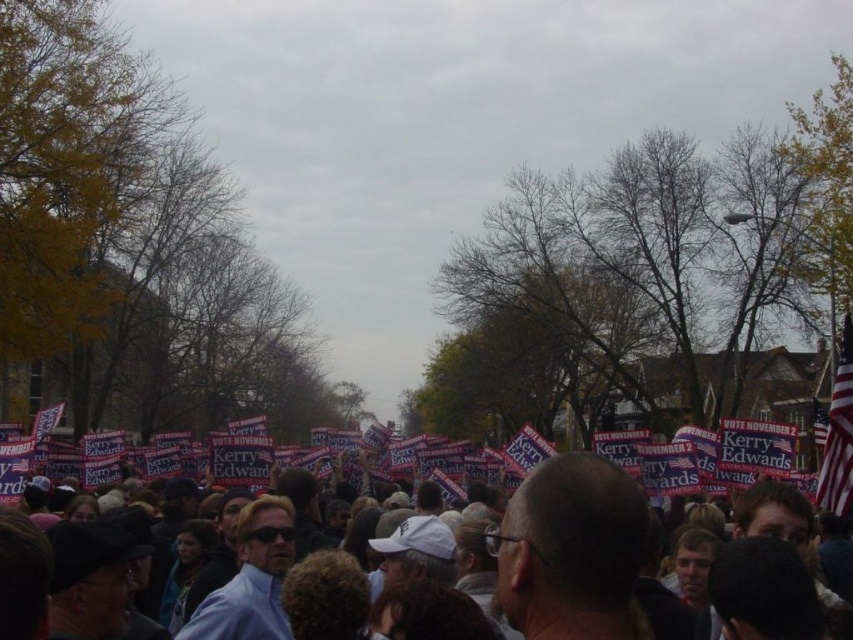
You are a photographer at the rally and want to capture both the red plastic signs at center and the american flag at right in a single frame. Based on their positions, which object should you focus on first to ensure both are in the shot?

The red plastic signs at center is positioned on the left side of american flag at right, so you should focus on the american flag at right first to ensure both objects are included in the frame.

You are a photographer at the political rally. You want to capture a photo of the red plastic signs at center without the american flag at right appearing in the foreground. Is this possible based on their positions?

The red plastic signs at center is positioned under the american flag at right, so the flag is directly above the signs. To avoid the flag in the foreground, you would need to angle the camera downward or move to a position where the flag is not blocking the view from above.